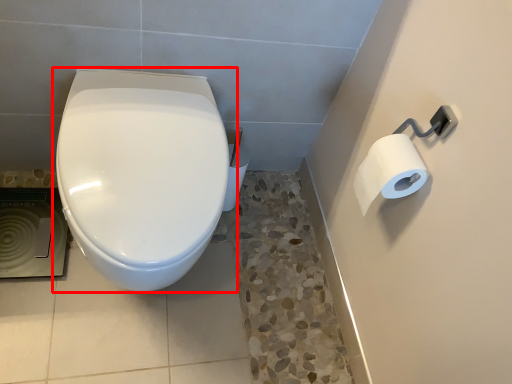
Question: From the image, what is the correct spatial relationship of toilet (annotated by the red box) in relation to toilet paper?

Choices:
 (A) right
 (B) left

Answer: (B)